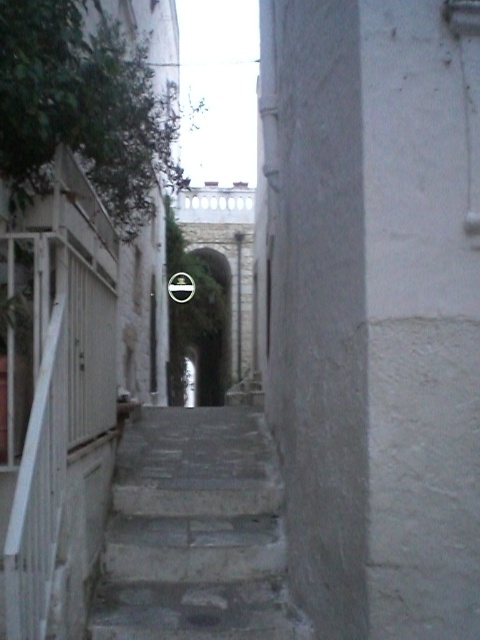
You are a delivery person carrying a large package and need to navigate through the narrow alleyway. You see the concrete stairs at center and the white matte rail at left. Which object is shorter in height?

The concrete stairs at center is not as tall as the white matte rail at left, so the concrete stairs at center is shorter in height.

You are standing at the entrance of the alleyway and want to go up the concrete stairs at center. To your left, there is a white matte rail at left. Which direction should you walk to reach the stairs first?

You should walk forward towards the concrete stairs at center because it is located below the white matte rail at left, meaning the stairs are positioned in front of the rail and closer to your starting point at the entrance.